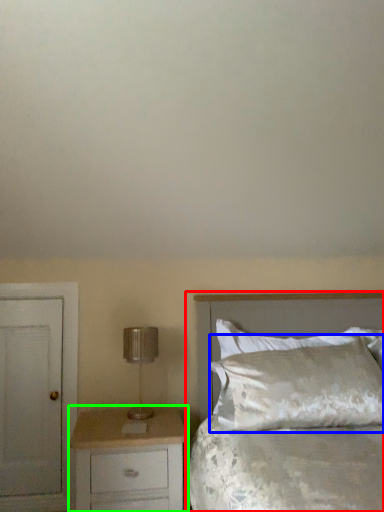
Question: Based on their relative distances, which object is nearer to bed (highlighted by a red box)? Choose from pillow (highlighted by a blue box) and chest of drawers (highlighted by a green box).

Choices:
 (A) pillow
 (B) chest of drawers

Answer: (A)